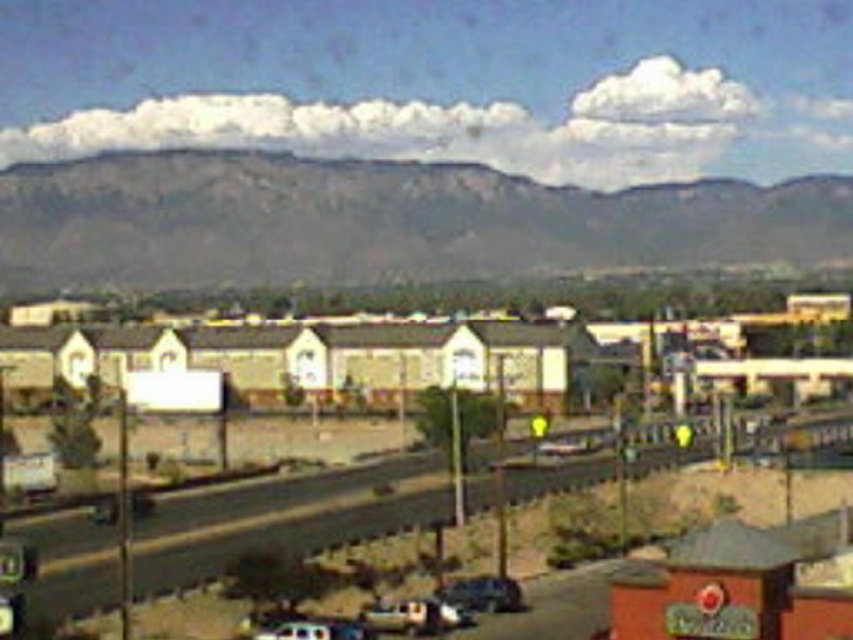
Is beige stucco houses at center taller than metallic silver car at lower center?

Indeed, beige stucco houses at center has a greater height compared to metallic silver car at lower center.

Is beige stucco houses at center wider than metallic silver car at lower center?

Correct, the width of beige stucco houses at center exceeds that of metallic silver car at lower center.

You are a GUI agent. You are given a task and a screenshot of the screen. Output one action in this format:
    pyautogui.click(x=<x>, y=<y>)
    Task: Click on the beige stucco houses at center
    This screenshot has height=640, width=853.
    Given the screenshot: What is the action you would take?
    pyautogui.click(x=451, y=355)

Between rugged stone mountain at upper center and beige stucco houses at center, which one has less height?

With less height is beige stucco houses at center.

Which is below, rugged stone mountain at upper center or beige stucco houses at center?

beige stucco houses at center

Which is in front, point (403, 269) or point (68, 323)?

Positioned in front is point (68, 323).

This screenshot has width=853, height=640. Identify the location of rugged stone mountain at upper center. [383, 221].

Measure the distance between rugged stone mountain at upper center and metallic silver car at lower center.

188.55 meters

Measure the distance between rugged stone mountain at upper center and metallic silver car at lower center.

188.55 meters

Which is in front, point (242, 236) or point (463, 609)?

Point (463, 609) is in front.

The height and width of the screenshot is (640, 853). Find the location of `rugged stone mountain at upper center`. rugged stone mountain at upper center is located at coordinates (383, 221).